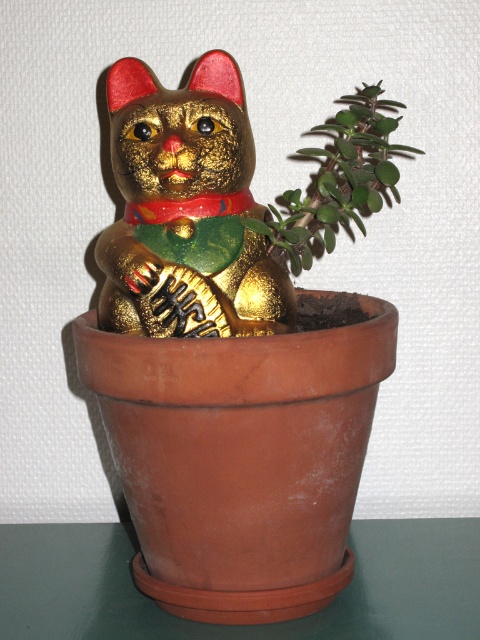
You are arranging a shelf and need to know the vertical positioning of the gold glitter cat at center and the green succulent at upper right. Which one is placed higher up?

The gold glitter cat at center is below green succulent at upper right, so the green succulent at upper right is placed higher up.

Consider the image. You are a gardener who wants to place a new plant between the gold glitter cat at center and the green succulent at upper right. The plant requires a minimum of 12 centimeters of space to grow properly. Based on the current spacing between these two objects, will there be enough space for the new plant?

The gold glitter cat at center and the green succulent at upper right are 11.15 centimeters apart. Since the required space for the new plant is 12 centimeters, there is insufficient space between them to accommodate the plant.